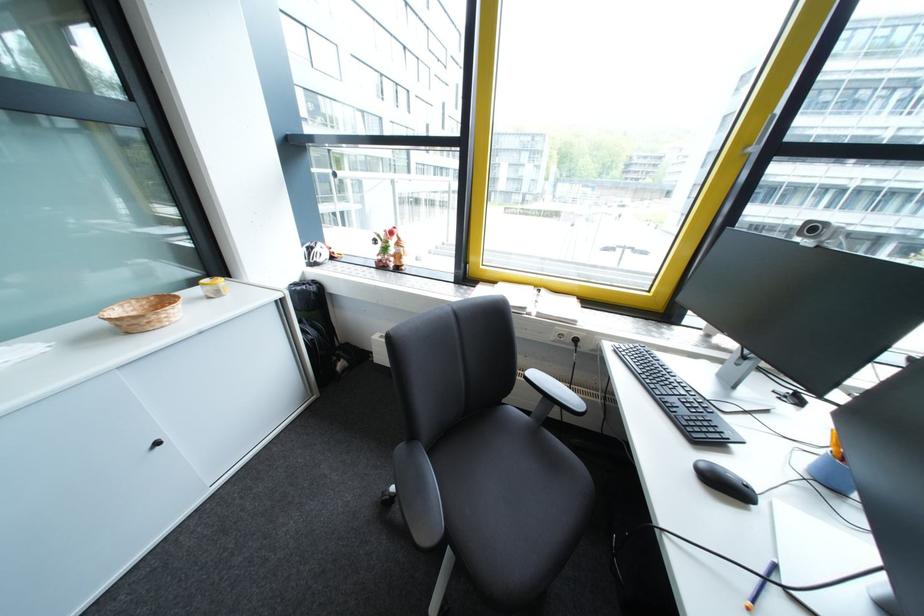
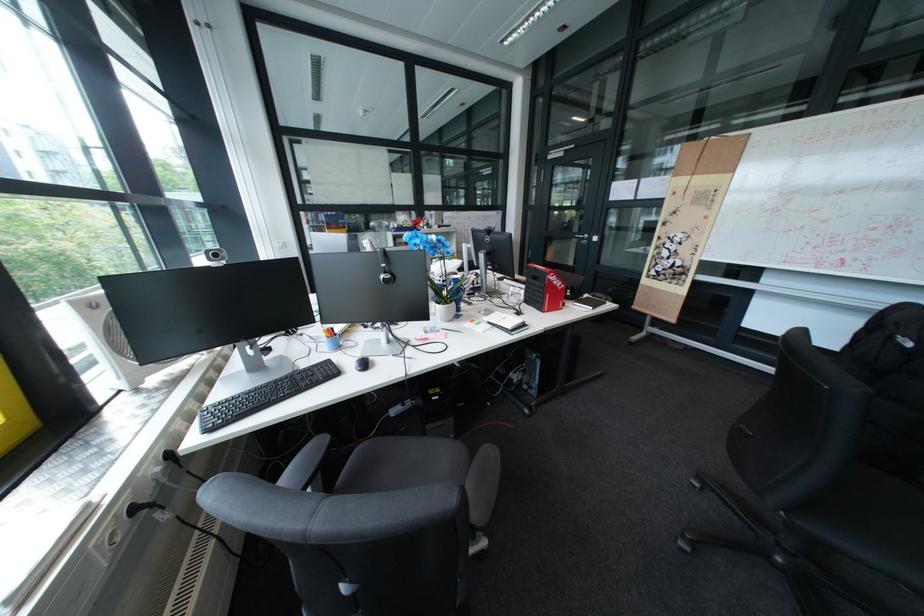
Find the pixel in the second image that matches [643,355] in the first image.

(245, 413)